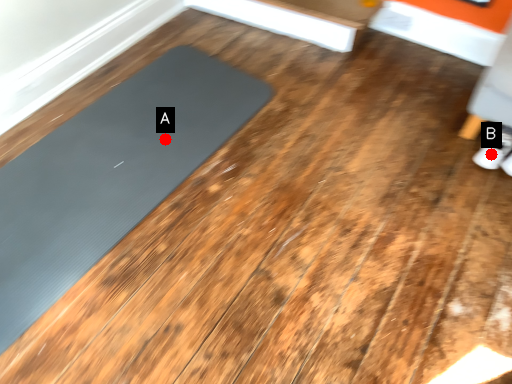
Question: Two points are circled on the image, labeled by A and B beside each circle. Which of the following is the farthest from the observer?

Choices:
 (A) A is further
 (B) B is further

Answer: (A)